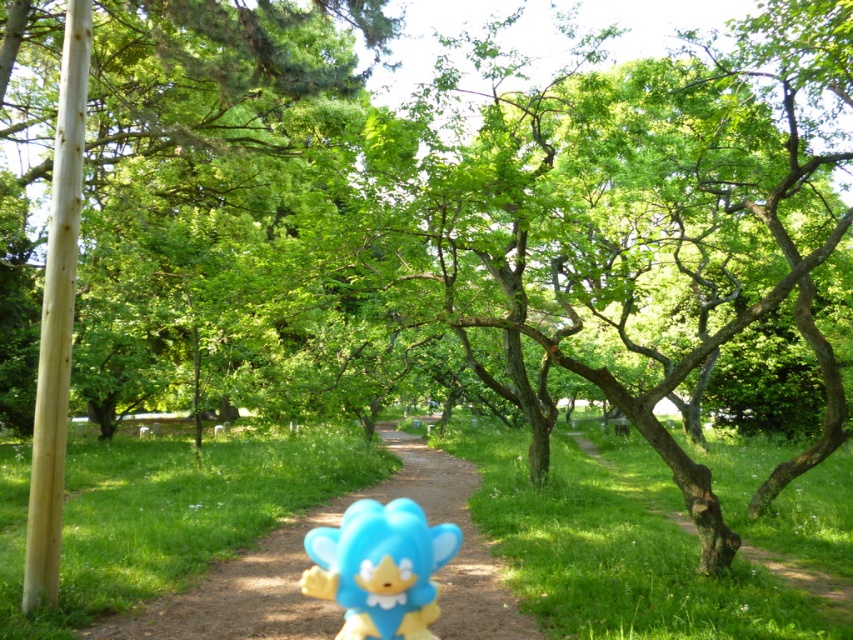
You are a child who wants to play with the blue rubber toy at center. There is a green leafy tree at center blocking the way. Can you walk around the tree to reach the toy?

The green leafy tree at center might be wider than blue rubber toy at center, so it is possible that the tree is too wide to walk around easily. You may need to find another path or ask for help.

You are a child who wants to pick up both the blue plastic toy at center and the blue rubber toy at center. Which toy should you pick up first if you want to grab the one closer to you?

You should pick up the blue plastic toy at center first because it is closer to you than the blue rubber toy at center, which is positioned behind it.